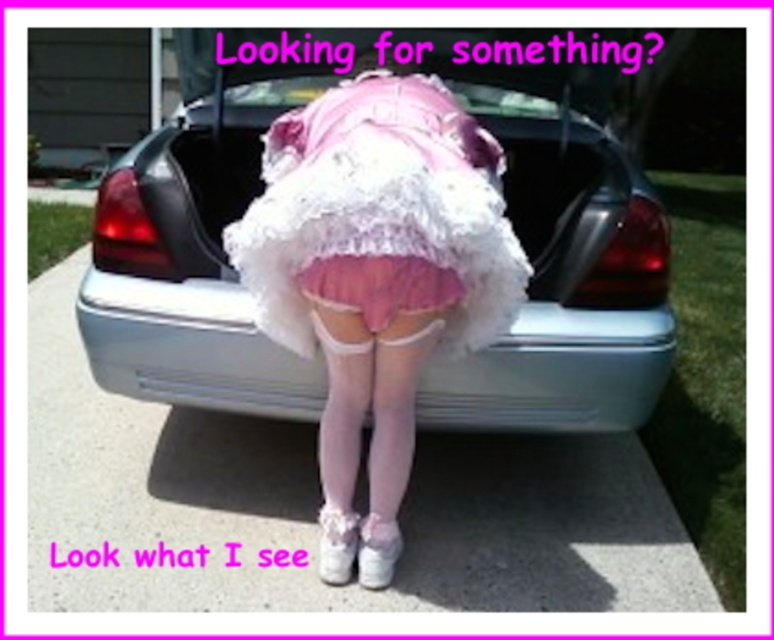
You are a photographer trying to capture the person in the pink and white outfit leaning against the car. Since the fuzzy white skirt at center is behind the white glossy sedan at center, will the skirt be visible in the photo if you focus on the car?

The fuzzy white skirt at center is behind the white glossy sedan at center, so it will not be visible in the photo if you focus on the car.

You are a photographer setting up for a photoshoot. You need to position the white glossy sedan at center and the pink satin ballet skirt at center in a way that the sedan is to the right of the skirt. Based on the scene description, is this already the case?

Yes, the white glossy sedan at center is already positioned to the right of the pink satin ballet skirt at center as described.

You are a photographer trying to capture the person in the scene. Since both the fuzzy white skirt at center and the pink satin ballet skirt at center are at the center, which one should you focus on to ensure the subject is clearly visible in your shot?

The fuzzy white skirt at center has a greater height compared to the pink satin ballet skirt at center, so focusing on the fuzzy white skirt at center would ensure the subject is clearly visible as it stands out more in height.